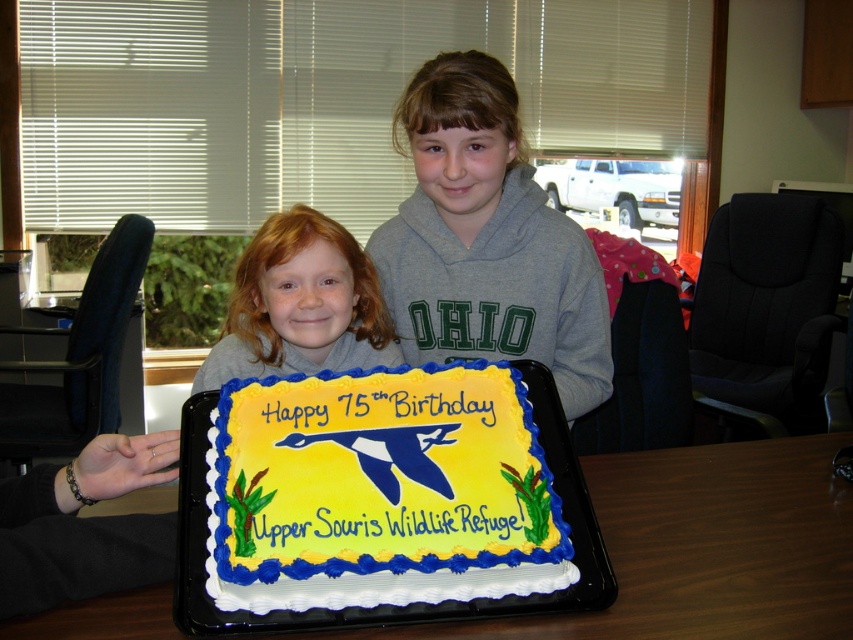
Question: Among these points, which one is nearest to the camera?

Choices:
 (A) (468, 108)
 (B) (822, 513)

Answer: (A)

Question: Which object is the farthest from the blonde hair at center?

Choices:
 (A) gray fleece sweatshirt at center
 (B) yellow fondant cake at center

Answer: (B)

Question: Is yellow fondant cake at center positioned before white plastic tray at lower center?

Choices:
 (A) yes
 (B) no

Answer: (A)

Question: Among these points, which one is farthest from the camera?

Choices:
 (A) (474, 372)
 (B) (346, 577)

Answer: (A)

Question: Does yellow fondant cake at center appear over white plastic tray at lower center?

Choices:
 (A) no
 (B) yes

Answer: (B)

Question: Is white plastic tray at lower center above gray fleece sweatshirt at center?

Choices:
 (A) yes
 (B) no

Answer: (B)